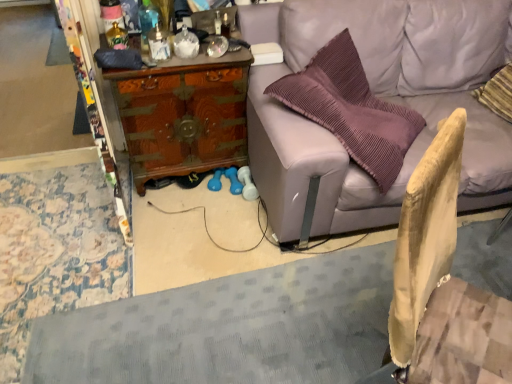
Question: Should I look upward or downward to see light brown wood swivel chair at lower right?

Choices:
 (A) down
 (B) up

Answer: (A)

Question: Should I look upward or downward to see wooden chest at center?

Choices:
 (A) up
 (B) down

Answer: (A)

Question: Is wooden chest at center completely or partially inside translucent glass bottle at upper left, which appears as the 2th bottle when viewed from the right?

Choices:
 (A) yes
 (B) no

Answer: (B)

Question: Considering the relative positions of translucent glass bottle at upper left, which is the first bottle in left-to-right order, and wooden chest at center in the image provided, is translucent glass bottle at upper left, which is the first bottle in left-to-right order, in front of wooden chest at center?

Choices:
 (A) no
 (B) yes

Answer: (B)

Question: Is translucent glass bottle at upper left, which is the first bottle in left-to-right order, further to the viewer compared to wooden chest at center?

Choices:
 (A) yes
 (B) no

Answer: (B)

Question: From the image's perspective, is translucent glass bottle at upper left, which is the first bottle in left-to-right order, located above wooden chest at center?

Choices:
 (A) no
 (B) yes

Answer: (B)

Question: From a real-world perspective, is translucent glass bottle at upper left, which appears as the 2th bottle when viewed from the right, physically above wooden chest at center?

Choices:
 (A) yes
 (B) no

Answer: (A)

Question: Is translucent glass bottle at upper left, which is the first bottle in left-to-right order, shorter than wooden chest at center?

Choices:
 (A) no
 (B) yes

Answer: (B)

Question: Is wooden chest at center aimed at light purple leather couch at upper right?

Choices:
 (A) yes
 (B) no

Answer: (B)

Question: Is wooden chest at center beside light purple leather couch at upper right?

Choices:
 (A) no
 (B) yes

Answer: (A)

Question: Does wooden chest at center have a larger size compared to light purple leather couch at upper right?

Choices:
 (A) yes
 (B) no

Answer: (B)

Question: Considering the relative sizes of wooden chest at center and light purple leather couch at upper right in the image provided, is wooden chest at center smaller than light purple leather couch at upper right?

Choices:
 (A) yes
 (B) no

Answer: (A)

Question: Are wooden chest at center and light purple leather couch at upper right located far from each other?

Choices:
 (A) no
 (B) yes

Answer: (A)

Question: Is wooden chest at center at the right side of light purple leather couch at upper right?

Choices:
 (A) no
 (B) yes

Answer: (A)

Question: Does light purple leather couch at upper right lie behind translucent glass bottle at upper left, which appears as the 2th bottle when viewed from the right?

Choices:
 (A) no
 (B) yes

Answer: (A)